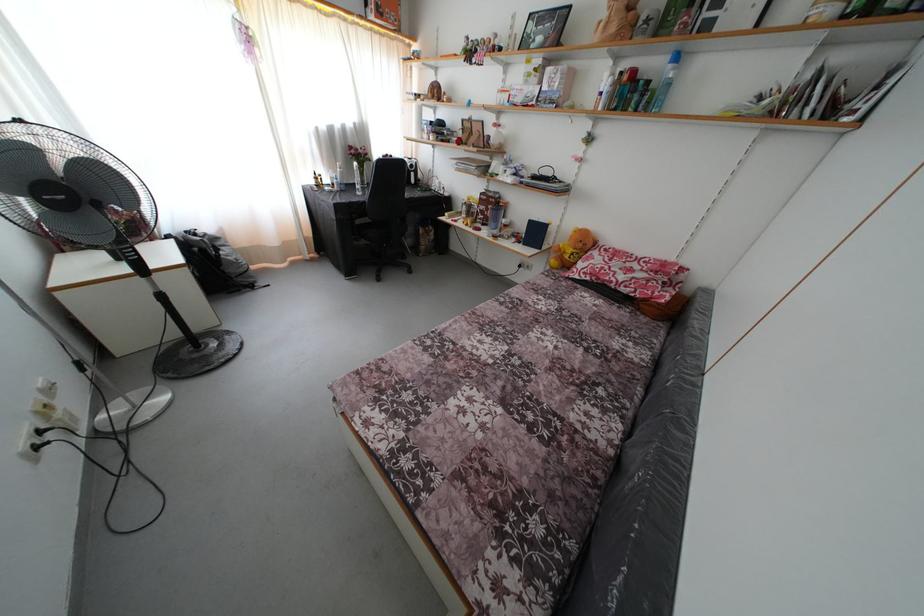
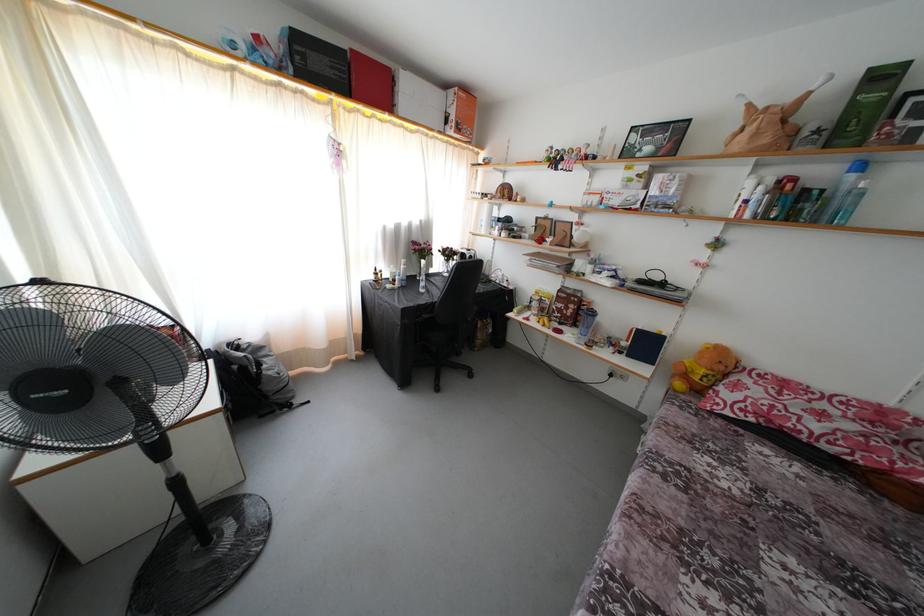
Where in the second image is the point corresponding to point (673, 63) from the first image?

(849, 172)